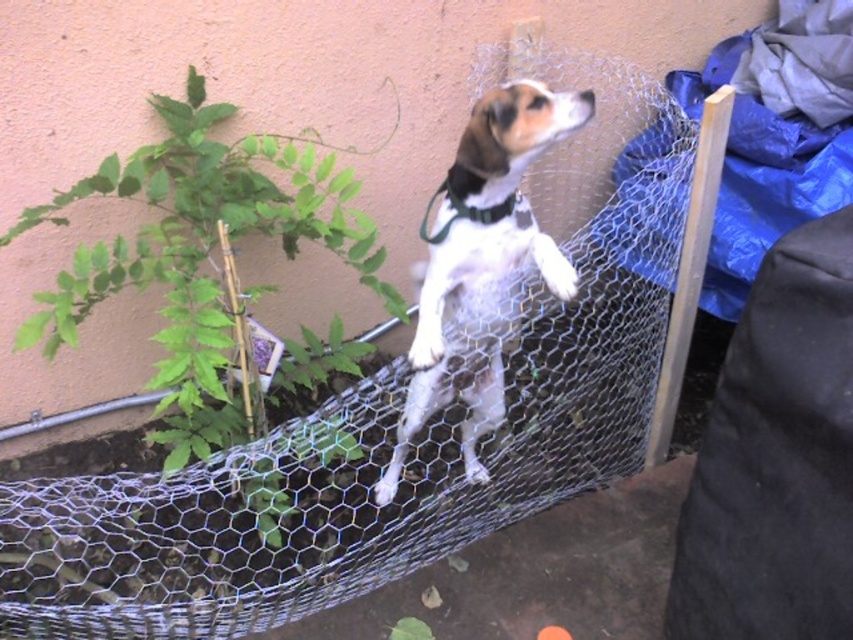
You are standing in front of a wire mesh fence where a small dog is standing on its hind legs. The dog is wearing a dark green harness and has its front paws on the fence. There is a point at coordinates (434, 387) in the image. If you want to reach this point with a stick that is 1.5 meters long, will the stick be long enough to reach it?

The point at coordinates (434, 387) is 1.61 meters away from the viewer. Since the stick is only 1.5 meters long, it will not be long enough to reach the point.